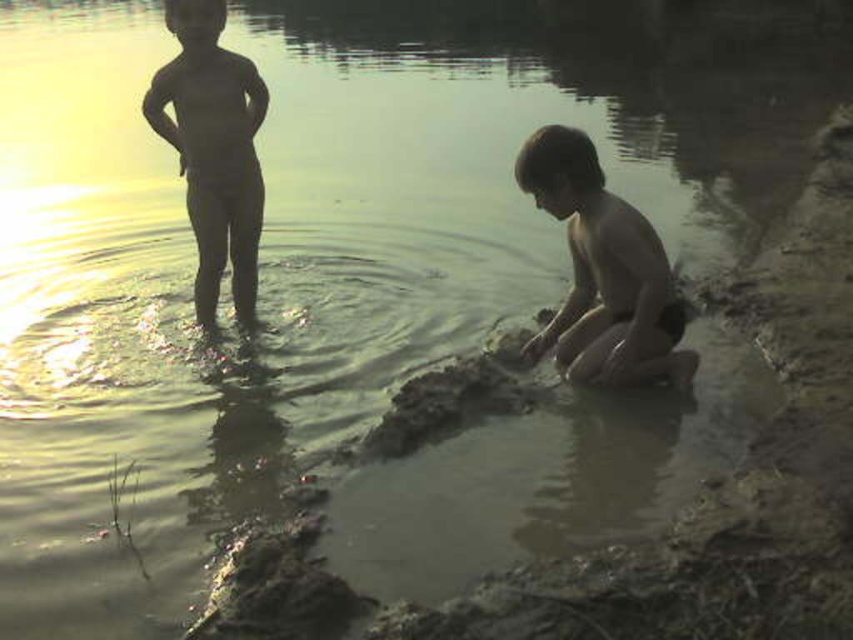
Question: Among these points, which one is nearest to the camera?

Choices:
 (A) click(x=195, y=294)
 (B) click(x=595, y=236)

Answer: (B)

Question: Which of the following is the closest to the observer?

Choices:
 (A) smooth skin child at left
 (B) smooth skin boy at lower right

Answer: (B)

Question: Does smooth skin boy at lower right appear on the left side of smooth skin child at left?

Choices:
 (A) yes
 (B) no

Answer: (B)

Question: Does smooth skin boy at lower right appear under smooth skin child at left?

Choices:
 (A) yes
 (B) no

Answer: (A)

Question: Is the position of smooth skin boy at lower right more distant than that of smooth skin child at left?

Choices:
 (A) yes
 (B) no

Answer: (B)